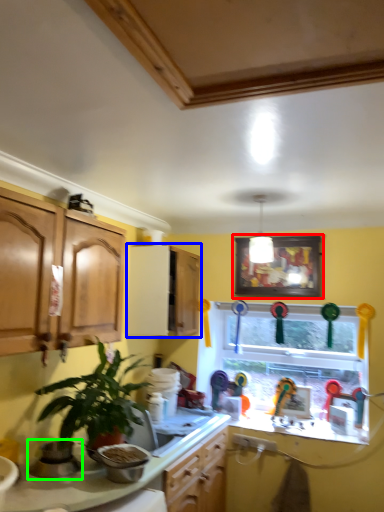
Question: Which object is positioned farthest from picture frame (highlighted by a red box)? Select from cabinetry (highlighted by a blue box) and appliance (highlighted by a green box).

Choices:
 (A) cabinetry
 (B) appliance

Answer: (B)